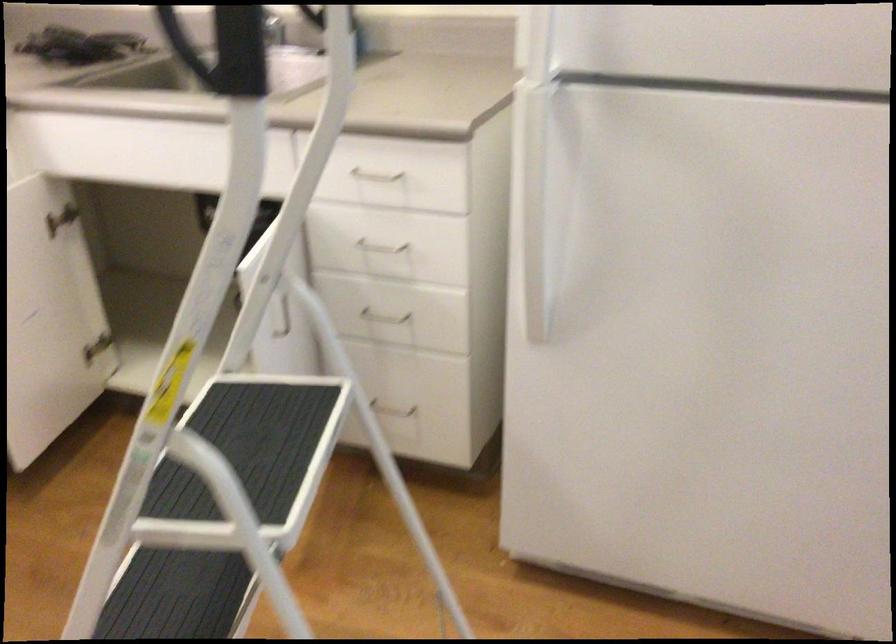
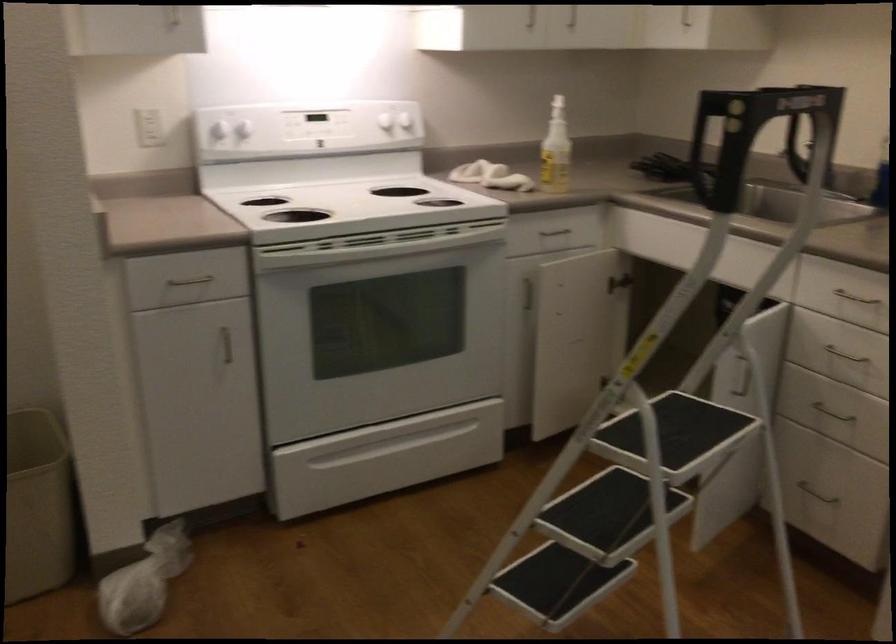
The point at (373, 167) is marked in the first image. Where is the corresponding point in the second image?

(863, 289)